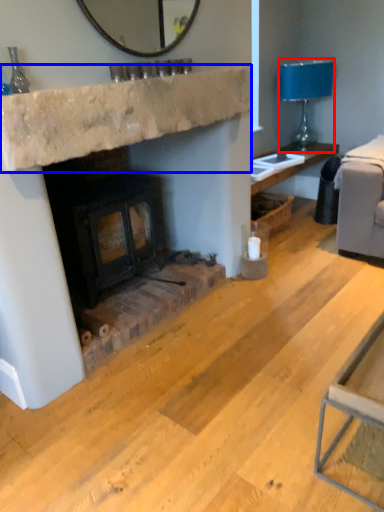
Question: Which object is closer to the camera taking this photo, lamp (highlighted by a red box) or counter top (highlighted by a blue box)?

Choices:
 (A) lamp
 (B) counter top

Answer: (B)